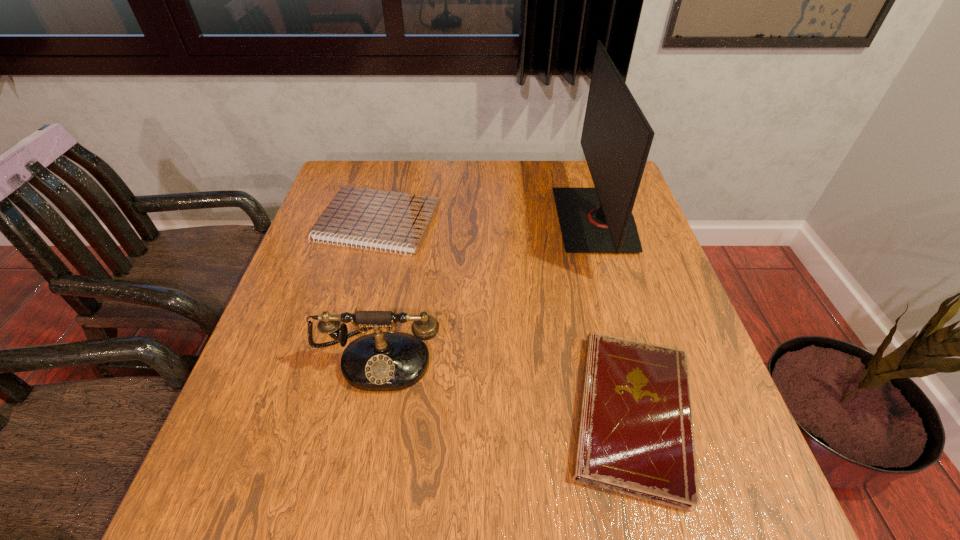
This screenshot has width=960, height=540. I want to click on the tallest object, so click(616, 138).

You are a GUI agent. You are given a task and a screenshot of the screen. Output one action in this format:
    pyautogui.click(x=<x>, y=<y>)
    Task: Click on the telephone
    This screenshot has width=960, height=540.
    Given the screenshot: What is the action you would take?
    pyautogui.click(x=381, y=361)

Identify the location of the farther notebook. Image resolution: width=960 pixels, height=540 pixels. (387, 220).

Identify the location of the right notebook. The height and width of the screenshot is (540, 960). (635, 437).

Identify the location of free location located 0.160m on the screen side of the tallest object. The height and width of the screenshot is (540, 960). (501, 220).

The height and width of the screenshot is (540, 960). Identify the location of free space located 0.130m on the screen side of the tallest object. (512, 220).

Identify the location of vacant space located on the screen side of the tallest object. The width and height of the screenshot is (960, 540). (497, 220).

At what (x,y) coordinates should I click in order to perform the action: click on vacant area situated on the dial of the second tallest object. Please return your answer as a coordinate pair (x, y). Looking at the image, I should click on (356, 479).

I want to click on vacant area located on the front of the farther notebook, so click(x=341, y=364).

Identify the location of free region located 0.340m on the left of the right notebook. 379,414.